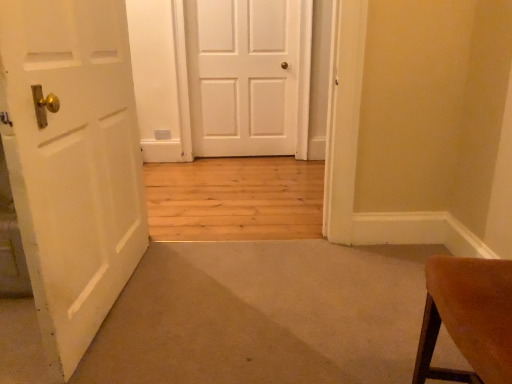
Identify the location of white matte door at center, which is the 1th door from top to bottom. The height and width of the screenshot is (384, 512). (243, 76).

This screenshot has height=384, width=512. Describe the element at coordinates (243, 76) in the screenshot. I see `white matte door at center, which is the 1th door from top to bottom` at that location.

What is the approximate height of white matte door at center, which is counted as the second door, starting from the back?

white matte door at center, which is counted as the second door, starting from the back, is 3.43 inches in height.

What are the coordinates of `white matte door at center, the first door from the front` in the screenshot? It's located at (264, 315).

This screenshot has height=384, width=512. What do you see at coordinates (264, 315) in the screenshot?
I see `white matte door at center, which is counted as the second door, starting from the back` at bounding box center [264, 315].

Image resolution: width=512 pixels, height=384 pixels. Identify the location of white matte door at center, which ranks as the first door in back-to-front order. (243, 76).

Considering the positions of objects white matte door at center, which is counted as the second door, starting from the back, and white matte door at center, which ranks as the first door in back-to-front order, in the image provided, who is more to the left, white matte door at center, which is counted as the second door, starting from the back, or white matte door at center, which ranks as the first door in back-to-front order,?

From the viewer's perspective, white matte door at center, which is counted as the second door, starting from the back, appears more on the left side.

Is the depth of white matte door at center, which is the second door from top to bottom, less than that of white matte door at center, which is the 1th door from top to bottom?

Yes, white matte door at center, which is the second door from top to bottom, is in front of white matte door at center, which is the 1th door from top to bottom.

Which is in front, point (183, 347) or point (198, 2)?

Point (183, 347)

From the image's perspective, which object appears higher, white matte door at center, which is the second door from top to bottom, or white matte door at center, arranged as the second door when viewed from the front?

white matte door at center, arranged as the second door when viewed from the front, is shown above in the image.

From a real-world perspective, is white matte door at center, which is counted as the second door, starting from the back, below white matte door at center, which is counted as the second door, starting from the bottom?

Yes, from a real-world perspective, white matte door at center, which is counted as the second door, starting from the back, is below white matte door at center, which is counted as the second door, starting from the bottom.

Looking at this image, in terms of width, does white matte door at center, marked as the 1th door in a bottom-to-top arrangement, look wider or thinner when compared to white matte door at center, which ranks as the first door in back-to-front order?

Considering their sizes, white matte door at center, marked as the 1th door in a bottom-to-top arrangement, looks broader than white matte door at center, which ranks as the first door in back-to-front order.

From their relative heights in the image, would you say white matte door at center, which is counted as the second door, starting from the back, is taller or shorter than white matte door at center, arranged as the second door when viewed from the front?

Considering their sizes, white matte door at center, which is counted as the second door, starting from the back, has less height than white matte door at center, arranged as the second door when viewed from the front.

Does white matte door at center, the first door from the front, have a smaller size compared to white matte door at center, which is counted as the second door, starting from the bottom?

No, white matte door at center, the first door from the front, is not smaller than white matte door at center, which is counted as the second door, starting from the bottom.

Is white matte door at center, which is counted as the second door, starting from the back, situated inside white matte door at center, which is counted as the second door, starting from the bottom, or outside?

white matte door at center, which is counted as the second door, starting from the back, is spatially situated outside white matte door at center, which is counted as the second door, starting from the bottom.

Are white matte door at center, which is the second door from top to bottom, and white matte door at center, which is counted as the second door, starting from the bottom, making contact?

white matte door at center, which is the second door from top to bottom, and white matte door at center, which is counted as the second door, starting from the bottom, are clearly separated.

In the scene shown: Is white matte door at center, the first door from the front, positioned with its back to white matte door at center, which is counted as the second door, starting from the bottom?

No, white matte door at center, the first door from the front,'s orientation is not away from white matte door at center, which is counted as the second door, starting from the bottom.

How many degrees apart are the facing directions of white matte door at center, which is the second door from top to bottom, and white matte door at center, arranged as the second door when viewed from the front?

There is a 178-degree angle between the facing directions of white matte door at center, which is the second door from top to bottom, and white matte door at center, arranged as the second door when viewed from the front.

How far apart are white matte door at center, which is counted as the second door, starting from the back, and white matte door at center, which is the 1th door from top to bottom?

white matte door at center, which is counted as the second door, starting from the back, and white matte door at center, which is the 1th door from top to bottom, are 7.71 feet apart.

Locate an element on the screen. door above the white matte door at center, the first door from the front (from the image's perspective) is located at coordinates (243, 76).

In the scene shown: Considering the positions of objects white matte door at center, which ranks as the first door in back-to-front order, and white matte door at center, which is counted as the second door, starting from the back, in the image provided, who is more to the left, white matte door at center, which ranks as the first door in back-to-front order, or white matte door at center, which is counted as the second door, starting from the back,?

From the viewer's perspective, white matte door at center, which is counted as the second door, starting from the back, appears more on the left side.

In the scene shown: Is white matte door at center, arranged as the second door when viewed from the front, positioned before white matte door at center, which is counted as the second door, starting from the back?

No, it is not.

Which is nearer, (x=220, y=124) or (x=357, y=286)?

Point (x=220, y=124) is positioned farther from the camera compared to point (x=357, y=286).

From the image's perspective, is white matte door at center, which ranks as the first door in back-to-front order, positioned above or below white matte door at center, the first door from the front?

Clearly, from the image's perspective, white matte door at center, which ranks as the first door in back-to-front order, is above white matte door at center, the first door from the front.

From a real-world perspective, is white matte door at center, which ranks as the first door in back-to-front order, physically located above or below white matte door at center, which is the second door from top to bottom?

white matte door at center, which ranks as the first door in back-to-front order, is above white matte door at center, which is the second door from top to bottom.

Is white matte door at center, which is the 1th door from top to bottom, thinner than white matte door at center, marked as the 1th door in a bottom-to-top arrangement?

Correct, the width of white matte door at center, which is the 1th door from top to bottom, is less than that of white matte door at center, marked as the 1th door in a bottom-to-top arrangement.

Considering the sizes of white matte door at center, which is the 1th door from top to bottom, and white matte door at center, the first door from the front, in the image, is white matte door at center, which is the 1th door from top to bottom, taller or shorter than white matte door at center, the first door from the front,?

Clearly, white matte door at center, which is the 1th door from top to bottom, is taller compared to white matte door at center, the first door from the front.

Looking at the image, does white matte door at center, arranged as the second door when viewed from the front, seem bigger or smaller compared to white matte door at center, which is counted as the second door, starting from the back?

Clearly, white matte door at center, arranged as the second door when viewed from the front, is smaller in size than white matte door at center, which is counted as the second door, starting from the back.

Is white matte door at center, arranged as the second door when viewed from the front, positioned beyond the bounds of white matte door at center, which is the second door from top to bottom?

That's correct, white matte door at center, arranged as the second door when viewed from the front, is outside of white matte door at center, which is the second door from top to bottom.

Is white matte door at center, which ranks as the first door in back-to-front order, not close to white matte door at center, which is the second door from top to bottom?

Yes, white matte door at center, which ranks as the first door in back-to-front order, and white matte door at center, which is the second door from top to bottom, are quite far apart.

Is white matte door at center, which is the 1th door from top to bottom, aimed at white matte door at center, the first door from the front?

Yes, white matte door at center, which is the 1th door from top to bottom, is oriented towards white matte door at center, the first door from the front.

How distant is white matte door at center, arranged as the second door when viewed from the front, from white matte door at center, which is counted as the second door, starting from the back?

A distance of 7.71 feet exists between white matte door at center, arranged as the second door when viewed from the front, and white matte door at center, which is counted as the second door, starting from the back.

Identify the location of door on the right of white matte door at center, which is counted as the second door, starting from the back. (243, 76).

Image resolution: width=512 pixels, height=384 pixels. In the image, there is a white matte door at center, which is counted as the second door, starting from the bottom. Find the location of `door below it (from the image's perspective)`. door below it (from the image's perspective) is located at coordinates (264, 315).

You are a GUI agent. You are given a task and a screenshot of the screen. Output one action in this format:
    pyautogui.click(x=<x>, y=<y>)
    Task: Click on the door in front of the white matte door at center, which is the 1th door from top to bottom
    Image resolution: width=512 pixels, height=384 pixels.
    Given the screenshot: What is the action you would take?
    point(264,315)